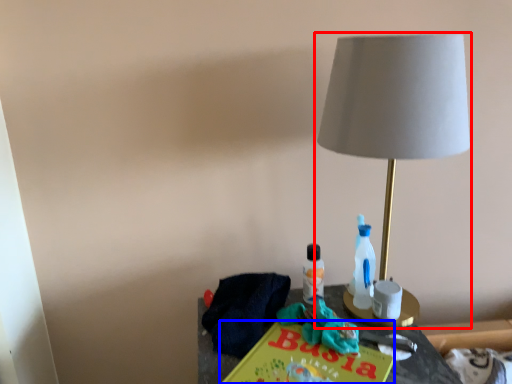
Question: Which point is closer to the camera, lamp (highlighted by a red box) or paperback book (highlighted by a blue box)?

Choices:
 (A) lamp
 (B) paperback book

Answer: (B)